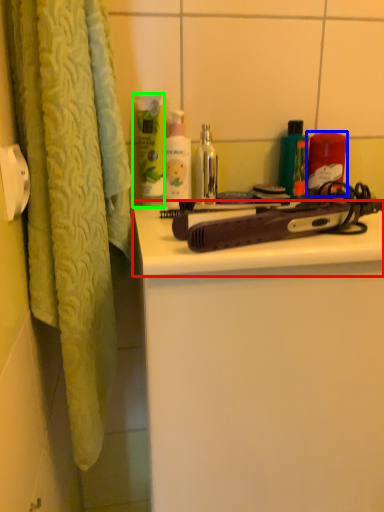
Question: Which object is the closest to the counter top (highlighted by a red box)? Choose among these: product (highlighted by a blue box) or cleaning product (highlighted by a green box).

Choices:
 (A) product
 (B) cleaning product

Answer: (B)